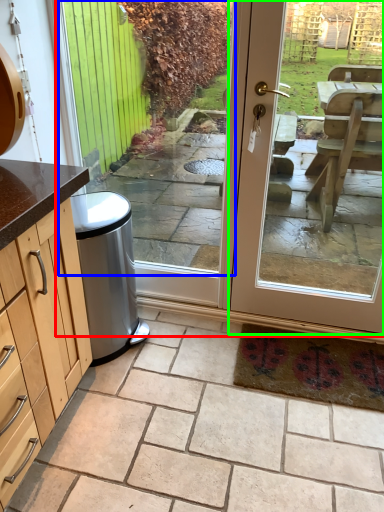
Question: Considering the real-world distances, which object is closest to screen door (highlighted by a red box)? window (highlighted by a blue box) or door (highlighted by a green box).

Choices:
 (A) window
 (B) door

Answer: (B)